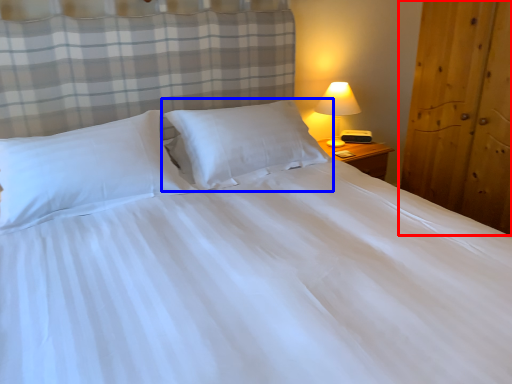
Question: Which point is further to the camera, armoire (highlighted by a red box) or pillow (highlighted by a blue box)?

Choices:
 (A) armoire
 (B) pillow

Answer: (B)